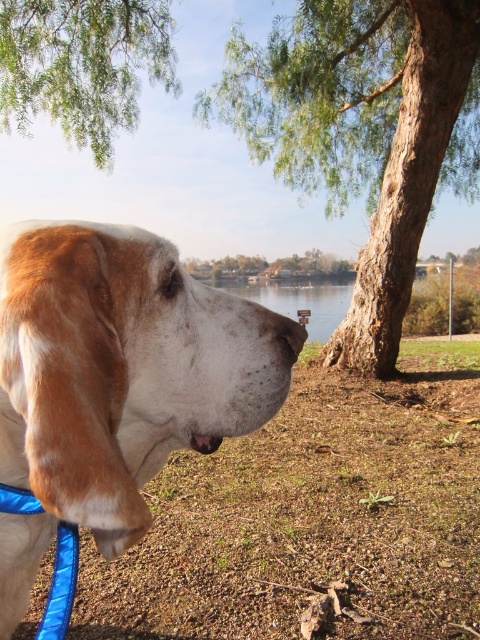
You are a photographer trying to capture the brown fur dog at left and the clear water at center in the same frame. Based on their sizes in the image, which object would require you to adjust your camera settings to focus on a closer subject?

The brown fur dog at left has a lesser width compared to clear water at center, so the photographer should adjust the camera focus to the brown fur dog at left since it is closer and smaller in the frame.

You are standing in a park and see a dog with a blue leash attached to its collar. There is a point marked at coordinates (83,65). Based on the scene, can you tell me what object this point is located on?

The point at (83,65) is located on the green leafy tree at upper left.

You are taking a photo of the dog and notice two points in the image. One is at point (x=97, y=259) and the other at point (x=336, y=109). Which point is closer to the camera?

Point (x=97, y=259) is closer to the camera than point (x=336, y=109).